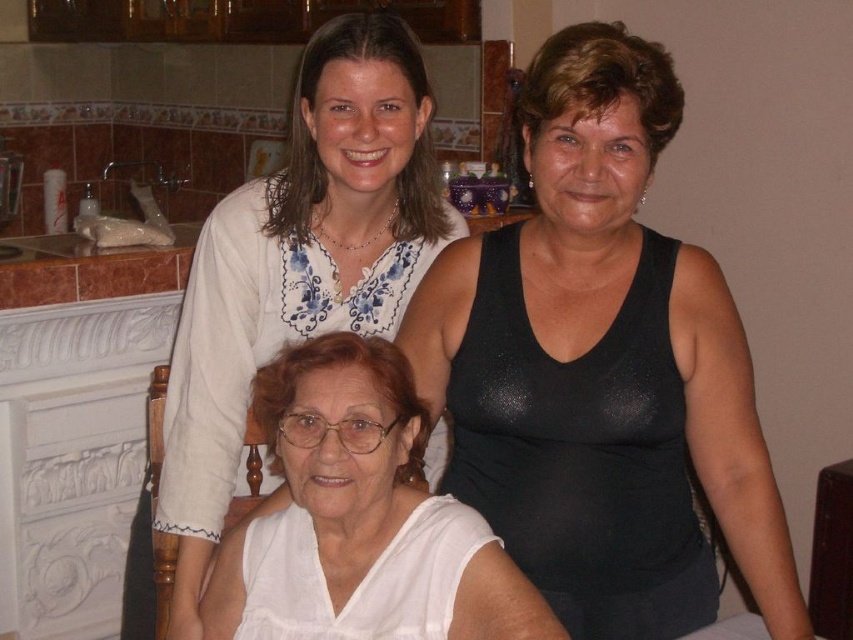
Question: Does white fabric at center have a greater width compared to white matte shirt at center?

Choices:
 (A) no
 (B) yes

Answer: (B)

Question: Which is nearer to the white matte shirt at center?

Choices:
 (A) black shiny tank top at upper right
 (B) white fabric at center

Answer: (A)

Question: Can you confirm if black shiny tank top at upper right is smaller than white fabric at center?

Choices:
 (A) yes
 (B) no

Answer: (A)

Question: Estimate the real-world distances between objects in this image. Which object is farther from the white matte shirt at center?

Choices:
 (A) white fabric at center
 (B) black shiny tank top at upper right

Answer: (A)

Question: Is black shiny tank top at upper right to the right of white matte shirt at center from the viewer's perspective?

Choices:
 (A) yes
 (B) no

Answer: (A)

Question: Which of these objects is positioned farthest from the white matte shirt at center?

Choices:
 (A) white fabric at center
 (B) black shiny tank top at upper right

Answer: (A)